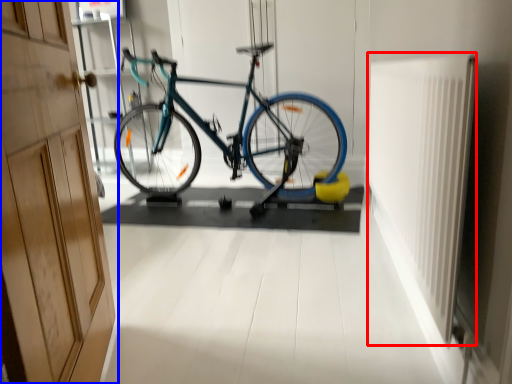
Question: Among these objects, which one is nearest to the camera, radiator (highlighted by a red box) or door (highlighted by a blue box)?

Choices:
 (A) radiator
 (B) door

Answer: (B)